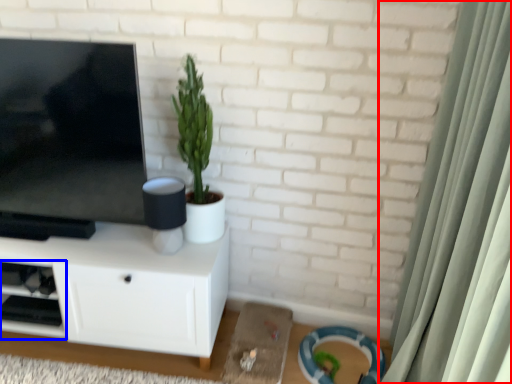
Question: Which of the following is the closest to the observer, curtain (highlighted by a red box) or shelf (highlighted by a blue box)?

Choices:
 (A) curtain
 (B) shelf

Answer: (A)